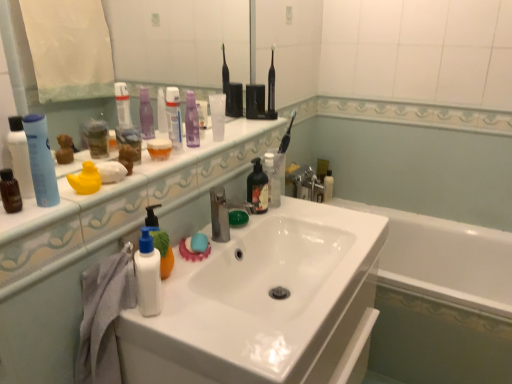
You are a GUI agent. You are given a task and a screenshot of the screen. Output one action in this format:
    pyautogui.click(x=<x>, y=<y>)
    Task: Click on the vacant space in front of purple matte lotion at center, marked as the 2th toiletry in a back-to-front arrangement
    This screenshot has height=384, width=512.
    Given the screenshot: What is the action you would take?
    pyautogui.click(x=188, y=151)